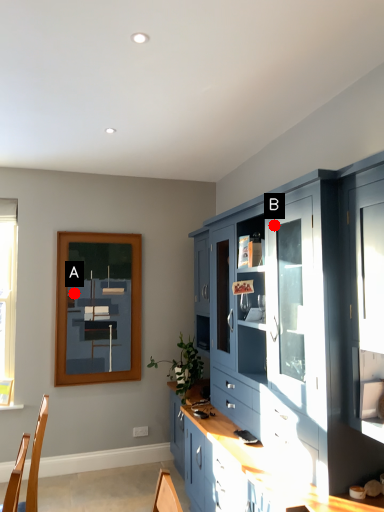
Question: Two points are circled on the image, labeled by A and B beside each circle. Among these points, which one is nearest to the camera?

Choices:
 (A) A is closer
 (B) B is closer

Answer: (B)